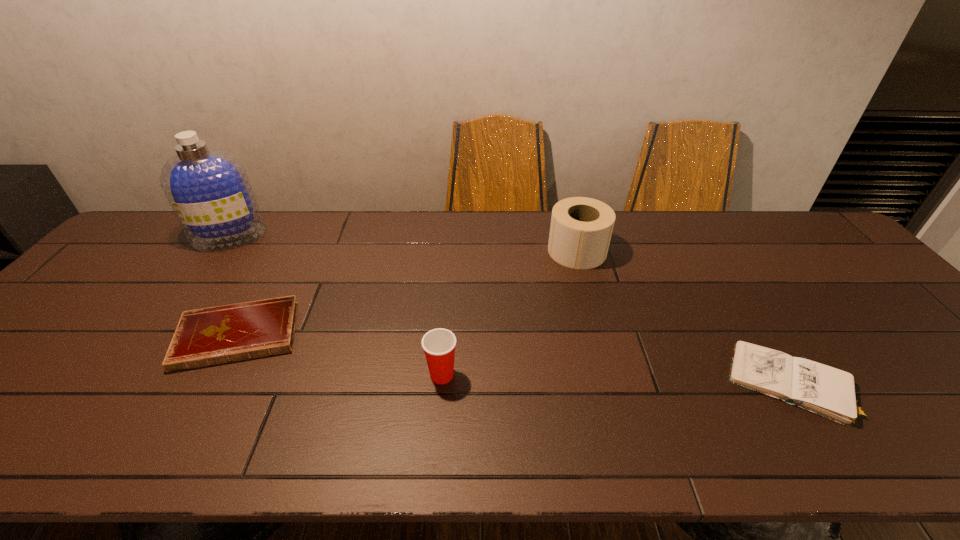
Choose which object is the third nearest neighbor to the toilet tissue. Please provide its 2D coordinates. Your answer should be formatted as a tuple, i.e. [(x, y)], where the tuple contains the x and y coordinates of a point satisfying the conditions above.

[(209, 336)]

The width and height of the screenshot is (960, 540). Identify the location of vacant space that satisfies the following two spatial constraints: 1. on the front side of the third shortest object; 2. on the left side of the cleansing agent. (130, 375).

Where is `free spot that satisfies the following two spatial constraints: 1. on the front side of the left notebook; 2. on the right side of the cleansing agent`? The height and width of the screenshot is (540, 960). free spot that satisfies the following two spatial constraints: 1. on the front side of the left notebook; 2. on the right side of the cleansing agent is located at coordinates (157, 335).

Find the location of `vacant area that satisfies the following two spatial constraints: 1. on the front side of the toilet tissue; 2. on the left side of the right notebook`. vacant area that satisfies the following two spatial constraints: 1. on the front side of the toilet tissue; 2. on the left side of the right notebook is located at coordinates (612, 383).